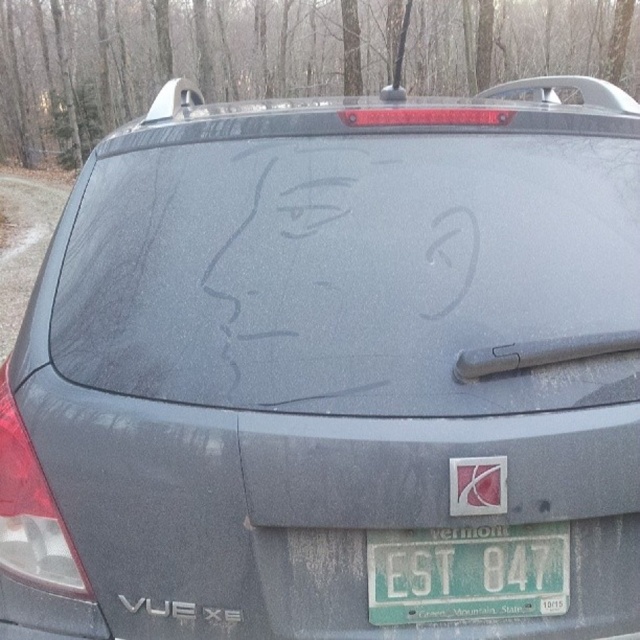
Question: From the image, what is the correct spatial relationship of frosted glass drawing at center in relation to green matte license plate at lower center?

Choices:
 (A) above
 (B) below

Answer: (A)

Question: Is frosted glass drawing at center to the right of matte gray text at lower center from the viewer's perspective?

Choices:
 (A) no
 (B) yes

Answer: (B)

Question: Which point is farther from the camera taking this photo?

Choices:
 (A) (180, 177)
 (B) (188, 609)

Answer: (A)

Question: Estimate the real-world distances between objects in this image. Which object is farther from the matte gray text at lower center?

Choices:
 (A) matte plastic sticker at center
 (B) frosted glass drawing at center
 (C) green matte license plate at lower center

Answer: (A)

Question: Among these points, which one is nearest to the camera?

Choices:
 (A) coord(470,529)
 (B) coord(211,620)
 (C) coord(234,234)
 (D) coord(467,486)

Answer: (D)

Question: Can you confirm if green matte license plate at lower center is smaller than matte gray text at lower center?

Choices:
 (A) no
 (B) yes

Answer: (A)